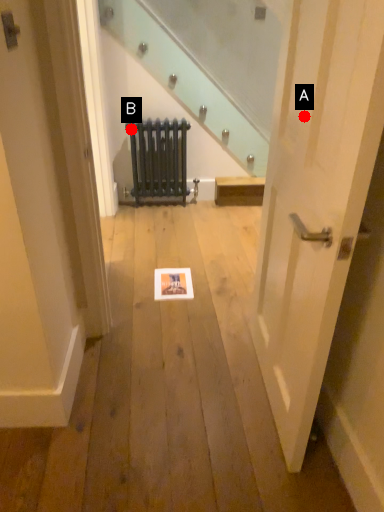
Question: Two points are circled on the image, labeled by A and B beside each circle. Which of the following is the farthest from the observer?

Choices:
 (A) A is further
 (B) B is further

Answer: (B)